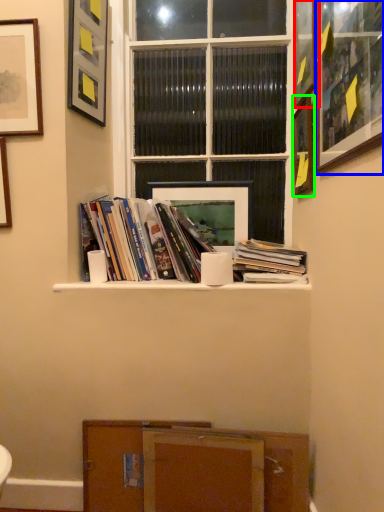
Question: Which object is positioned closest to picture frame (highlighted by a red box)? Select from picture frame (highlighted by a blue box) and picture frame (highlighted by a green box).

Choices:
 (A) picture frame
 (B) picture frame

Answer: (B)